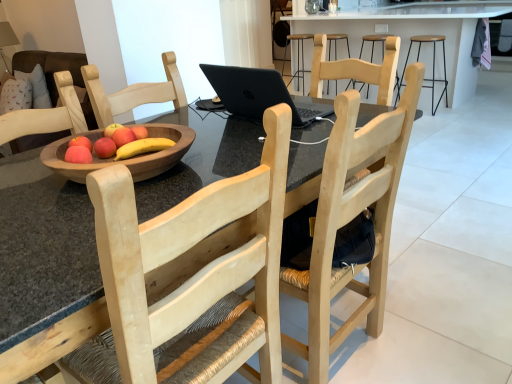
The height and width of the screenshot is (384, 512). I want to click on natural wood chair at center, which appears as the second chair when viewed from the left, so click(351, 220).

The width and height of the screenshot is (512, 384). Describe the element at coordinates (258, 93) in the screenshot. I see `black matte laptop at center` at that location.

At what (x,y) coordinates should I click in order to perform the action: click on black glossy table at center. Please return your answer as a coordinate pair (x, y). Image resolution: width=512 pixels, height=384 pixels. Looking at the image, I should click on (414, 32).

Between point (435, 94) and point (104, 153), which one is positioned behind?

The point (435, 94) is more distant.

Is matte wooden apple at center a part of black glossy table at center?

No, matte wooden apple at center is not a part of black glossy table at center.

Identify the location of apple that appears below the black glossy table at center (from the image's perspective). 105,148.

From a real-world perspective, relative to matte wooden apple at center, is black glossy table at center vertically above or below?

From a real-world perspective, black glossy table at center is physically below matte wooden apple at center.

Can you confirm if natural wood chair at center, which appears as the 1th chair when viewed from the right, is wider than matte wooden apple at center?

Correct, the width of natural wood chair at center, which appears as the 1th chair when viewed from the right, exceeds that of matte wooden apple at center.

Are natural wood chair at center, which appears as the 1th chair when viewed from the right, and matte wooden apple at center located far from each other?

They are positioned close to each other.

Which object is closer to the camera taking this photo, natural wood chair at center, which appears as the second chair when viewed from the left, or matte wooden apple at center?

natural wood chair at center, which appears as the second chair when viewed from the left.

Measure the distance between natural wood chair at center, which appears as the 1th chair when viewed from the right, and matte wooden apple at center.

natural wood chair at center, which appears as the 1th chair when viewed from the right, is 30.98 inches away from matte wooden apple at center.

Locate an element on the screen. The width and height of the screenshot is (512, 384). bar stool lying on the left of black glossy table at center is located at coordinates (298, 56).

Is point (293, 77) behind point (359, 25)?

Yes, point (293, 77) is farther from viewer.

Is metallic black bar stool at center bigger or smaller than black glossy table at center?

Clearly, metallic black bar stool at center is smaller in size than black glossy table at center.

From the picture: Is black glossy table at center at the back of metallic black bar stool at center?

Yes, metallic black bar stool at center's orientation is away from black glossy table at center.

How different are the orientations of metallic black bar stool at center and natural wood chair at center, which appears as the second chair when viewed from the left, in degrees?

There is a 91.4-degree angle between the facing directions of metallic black bar stool at center and natural wood chair at center, which appears as the second chair when viewed from the left.

Is natural wood chair at center, which appears as the 1th chair when viewed from the right, at the back of metallic black bar stool at center?

No, metallic black bar stool at center is not facing the opposite direction of natural wood chair at center, which appears as the 1th chair when viewed from the right.

From the image's perspective, is metallic black bar stool at center located above natural wood chair at center, which appears as the second chair when viewed from the left?

Yes, from the image's perspective, metallic black bar stool at center is over natural wood chair at center, which appears as the second chair when viewed from the left.

The image size is (512, 384). I want to click on chair that is the 2nd object above the metallic black bar stool at center (from a real-world perspective), so click(351, 220).

From the image's perspective, which one is positioned higher, matte wooden apple at center or metallic black bar stool at center?

From the image's view, metallic black bar stool at center is above.

Is matte wooden apple at center positioned with its back to metallic black bar stool at center?

No, matte wooden apple at center's orientation is not away from metallic black bar stool at center.

Is matte wooden apple at center in front of or behind metallic black bar stool at center in the image?

matte wooden apple at center is in front of metallic black bar stool at center.

At what (x,y) coordinates should I click in order to perform the action: click on bar stool behind the matte wooden apple at center. Please return your answer as a coordinate pair (x, y). The image size is (512, 384). Looking at the image, I should click on (298, 56).

Between metallic black bar stool at center and matte wooden apple at center, which one is positioned in front?

matte wooden apple at center is in front.

Which point is more distant from viewer, (303, 37) or (113, 145)?

Point (303, 37)

Relative to black matte laptop at center, is matte wooden apple at center in front or behind?

matte wooden apple at center is positioned closer to the viewer than black matte laptop at center.

From a real-world perspective, is matte wooden apple at center positioned under black matte laptop at center based on gravity?

Yes.

In terms of height, does matte wooden apple at center look taller or shorter compared to black matte laptop at center?

Considering their sizes, matte wooden apple at center has less height than black matte laptop at center.

This screenshot has width=512, height=384. Identify the location of apple below the black glossy table at center (from the image's perspective). (105, 148).

From a real-world perspective, count 1st chairs downward from the matte wooden apple at center and point to it. Please provide its 2D coordinates.

[(351, 220)]

Consider the image. Based on their spatial positions, is natural wood chair at center, the first chair in the left-to-right sequence, or black glossy table at center closer to black matte laptop at center?

natural wood chair at center, the first chair in the left-to-right sequence, lies closer to black matte laptop at center than the other object.

Based on their spatial positions, is matte wooden apple at center or metallic black bar stool at center further from black glossy table at center?

Based on the image, matte wooden apple at center appears to be further to black glossy table at center.

Based on their spatial positions, is black glossy table at center or black metal stool at upper right further from metallic black bar stool at center?

black metal stool at upper right lies further to metallic black bar stool at center than the other object.

Which object lies nearer to the anchor point black metal stool at upper right, natural wood chair at center, which appears as the 1th chair when viewed from the right, or black glossy table at center?

Among the two, black glossy table at center is located nearer to black metal stool at upper right.

When comparing their distances from natural wood chair at center, which is the 2th chair in right-to-left order, does natural wood chair at center, which appears as the second chair when viewed from the left, or black glossy table at center seem closer?

The object closer to natural wood chair at center, which is the 2th chair in right-to-left order, is natural wood chair at center, which appears as the second chair when viewed from the left.

When comparing their distances from metallic black bar stool at center, does matte wooden apple at center or black glossy table at center seem further?

matte wooden apple at center is further to metallic black bar stool at center.

Based on their spatial positions, is black matte laptop at center or matte wooden apple at center further from black metal stool at upper right?

Based on the image, matte wooden apple at center appears to be further to black metal stool at upper right.

Which object lies nearer to the anchor point black glossy table at center, black matte laptop at center or matte wooden apple at center?

black matte laptop at center is closer to black glossy table at center.

Where is `table positioned between matte wooden apple at center and black metal stool at upper right from near to far`? This screenshot has height=384, width=512. table positioned between matte wooden apple at center and black metal stool at upper right from near to far is located at coordinates (414, 32).

The height and width of the screenshot is (384, 512). In order to click on stool between matte wooden apple at center and metallic black bar stool at center from front to back in this screenshot , I will do `click(432, 69)`.

Where is `apple positioned between natural wood chair at center, which appears as the second chair when viewed from the left, and metallic black bar stool at center from near to far`? apple positioned between natural wood chair at center, which appears as the second chair when viewed from the left, and metallic black bar stool at center from near to far is located at coordinates pyautogui.click(x=105, y=148).

This screenshot has width=512, height=384. I want to click on table positioned between natural wood chair at center, which is the 2th chair in right-to-left order, and black metal stool at upper right from near to far, so click(x=414, y=32).